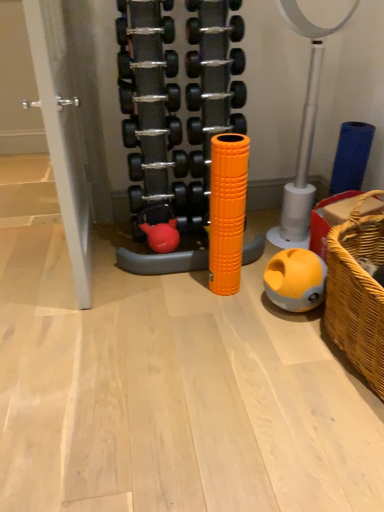
This screenshot has height=512, width=384. In order to click on yellow matte ball at lower right, positioned as the third toy in top-to-bottom order in this screenshot , I will do `click(295, 280)`.

Where is `orange rubber foam roller at center, the third toy in the bottom-to-top sequence`? orange rubber foam roller at center, the third toy in the bottom-to-top sequence is located at coordinates (177, 103).

How different are the orientations of orange rubber foam roller at center, the third toy in the bottom-to-top sequence, and woven brown basket at lower right in degrees?

orange rubber foam roller at center, the third toy in the bottom-to-top sequence, and woven brown basket at lower right are facing 90 degrees away from each other.

Does orange rubber foam roller at center, which is the 1th toy in top-to-bottom order, have a lesser height compared to woven brown basket at lower right?

Incorrect, the height of orange rubber foam roller at center, which is the 1th toy in top-to-bottom order, does not fall short of that of woven brown basket at lower right.

Is orange rubber foam roller at center, the third toy in the bottom-to-top sequence, spatially inside woven brown basket at lower right, or outside of it?

orange rubber foam roller at center, the third toy in the bottom-to-top sequence, is located beyond the bounds of woven brown basket at lower right.

Between orange rubber foam roller at center, the third toy in the bottom-to-top sequence, and woven brown basket at lower right, which one has smaller width?

woven brown basket at lower right.

From a real-world perspective, which is physically below, woven brown basket at lower right or orange rubber foam roller at center, which is the 1th toy in top-to-bottom order?

woven brown basket at lower right, from a real-world perspective.

Consider the image. From the image's perspective, which one is positioned higher, woven brown basket at lower right or orange rubber foam roller at center, the third toy in the bottom-to-top sequence?

From the image's view, orange rubber foam roller at center, the third toy in the bottom-to-top sequence, is above.

What's the angular difference between woven brown basket at lower right and orange rubber foam roller at center, which is the 1th toy in top-to-bottom order,'s facing directions?

90 degrees.

From the picture: In the image, is woven brown basket at lower right positioned in front of or behind orange rubber foam roller at center, the third toy in the bottom-to-top sequence?

Clearly, woven brown basket at lower right is in front of orange rubber foam roller at center, the third toy in the bottom-to-top sequence.

Find the location of `the 1st toy above the woven brown basket at lower right (from the image's perspective)`. the 1st toy above the woven brown basket at lower right (from the image's perspective) is located at coordinates (295, 280).

From a real-world perspective, who is located higher, yellow matte ball at lower right, the 1th toy ordered from the bottom, or woven brown basket at lower right?

From a 3D spatial view, woven brown basket at lower right is above.

From the image's perspective, which one is positioned lower, yellow matte ball at lower right, positioned as the third toy in top-to-bottom order, or woven brown basket at lower right?

woven brown basket at lower right appears lower in the image.

Is point (293, 263) farther from camera compared to point (372, 286)?

Yes, point (293, 263) is behind point (372, 286).

Based on the photo, is yellow matte ball at lower right, the 1th toy ordered from the bottom, to the left of rubberized red dumbbell at center, which ranks as the 2th toy in bottom-to-top order, from the viewer's perspective?

In fact, yellow matte ball at lower right, the 1th toy ordered from the bottom, is to the right of rubberized red dumbbell at center, which ranks as the 2th toy in bottom-to-top order.

Could you tell me if yellow matte ball at lower right, positioned as the third toy in top-to-bottom order, is facing rubberized red dumbbell at center, which ranks as the 2th toy in bottom-to-top order?

No.

Between yellow matte ball at lower right, the 1th toy ordered from the bottom, and rubberized red dumbbell at center, which ranks as the 2th toy in bottom-to-top order, which one has smaller width?

rubberized red dumbbell at center, which ranks as the 2th toy in bottom-to-top order, is thinner.

From the picture: Can you confirm if woven brown basket at lower right is positioned to the left of yellow matte ball at lower right, positioned as the third toy in top-to-bottom order?

In fact, woven brown basket at lower right is to the right of yellow matte ball at lower right, positioned as the third toy in top-to-bottom order.

Find the location of a particular element. toy that is the 1st object to the left of the woven brown basket at lower right, starting at the anchor is located at coordinates (295, 280).

From a real-world perspective, which is physically above, woven brown basket at lower right or yellow matte ball at lower right, positioned as the third toy in top-to-bottom order?

woven brown basket at lower right is physically above.

Is yellow matte ball at lower right, the 1th toy ordered from the bottom, surrounded by woven brown basket at lower right?

No.

Does yellow matte ball at lower right, positioned as the third toy in top-to-bottom order, touch orange rubber foam roller at center, the third toy in the bottom-to-top sequence?

yellow matte ball at lower right, positioned as the third toy in top-to-bottom order, and orange rubber foam roller at center, the third toy in the bottom-to-top sequence, are clearly separated.

Is yellow matte ball at lower right, positioned as the third toy in top-to-bottom order, looking in the opposite direction of orange rubber foam roller at center, the third toy in the bottom-to-top sequence?

yellow matte ball at lower right, positioned as the third toy in top-to-bottom order, is not turned away from orange rubber foam roller at center, the third toy in the bottom-to-top sequence.

Considering the relative sizes of yellow matte ball at lower right, positioned as the third toy in top-to-bottom order, and orange rubber foam roller at center, the third toy in the bottom-to-top sequence, in the image provided, is yellow matte ball at lower right, positioned as the third toy in top-to-bottom order, thinner than orange rubber foam roller at center, the third toy in the bottom-to-top sequence,?

Correct, the width of yellow matte ball at lower right, positioned as the third toy in top-to-bottom order, is less than that of orange rubber foam roller at center, the third toy in the bottom-to-top sequence.

Which is correct: orange rubber foam roller at center, the third toy in the bottom-to-top sequence, is inside yellow matte ball at lower right, the 1th toy ordered from the bottom, or outside of it?

orange rubber foam roller at center, the third toy in the bottom-to-top sequence, lies outside yellow matte ball at lower right, the 1th toy ordered from the bottom.

Locate an element on the screen. This screenshot has width=384, height=512. the 1st toy behind the orange rubber foam roller at center, the third toy in the bottom-to-top sequence, starting your count from the anchor is located at coordinates (295, 280).

Is orange rubber foam roller at center, which is the 1th toy in top-to-bottom order, thinner than yellow matte ball at lower right, positioned as the third toy in top-to-bottom order?

→ In fact, orange rubber foam roller at center, which is the 1th toy in top-to-bottom order, might be wider than yellow matte ball at lower right, positioned as the third toy in top-to-bottom order.

Based on the photo, does orange rubber foam roller at center, the third toy in the bottom-to-top sequence, appear on the left side of yellow matte ball at lower right, the 1th toy ordered from the bottom?

Yes.

The image size is (384, 512). There is a woven brown basket at lower right. What are the coordinates of `the 3rd toy above it (from the image's perspective)` in the screenshot? It's located at (177, 103).

Find the location of `basket that is below the orange rubber foam roller at center, which is the 1th toy in top-to-bottom order (from the image's perspective)`. basket that is below the orange rubber foam roller at center, which is the 1th toy in top-to-bottom order (from the image's perspective) is located at coordinates pyautogui.click(x=357, y=292).

From the image, which object appears to be farther from yellow matte ball at lower right, positioned as the third toy in top-to-bottom order, orange rubber foam roller at center, which is the 1th toy in top-to-bottom order, or woven brown basket at lower right?

orange rubber foam roller at center, which is the 1th toy in top-to-bottom order, is further to yellow matte ball at lower right, positioned as the third toy in top-to-bottom order.

In the scene shown: Which object lies further to the anchor point yellow matte ball at lower right, positioned as the third toy in top-to-bottom order, woven brown basket at lower right or rubberized red dumbbell at center, which ranks as the 2th toy in bottom-to-top order?

Among the two, rubberized red dumbbell at center, which ranks as the 2th toy in bottom-to-top order, is located further to yellow matte ball at lower right, positioned as the third toy in top-to-bottom order.

Which object lies further to the anchor point rubberized red dumbbell at center, placed as the 2th toy when sorted from top to bottom, yellow matte ball at lower right, positioned as the third toy in top-to-bottom order, or orange rubber foam roller at center, the third toy in the bottom-to-top sequence?

yellow matte ball at lower right, positioned as the third toy in top-to-bottom order.

Considering their positions, is orange rubber foam roller at center, which is the 1th toy in top-to-bottom order, positioned closer to rubberized red dumbbell at center, placed as the 2th toy when sorted from top to bottom, than woven brown basket at lower right?

orange rubber foam roller at center, which is the 1th toy in top-to-bottom order, lies closer to rubberized red dumbbell at center, placed as the 2th toy when sorted from top to bottom, than the other object.

Estimate the real-world distances between objects in this image. Which object is closer to woven brown basket at lower right, orange rubber foam roller at center, the third toy in the bottom-to-top sequence, or rubberized red dumbbell at center, which ranks as the 2th toy in bottom-to-top order?

Based on the image, orange rubber foam roller at center, the third toy in the bottom-to-top sequence, appears to be nearer to woven brown basket at lower right.

Considering their positions, is rubberized red dumbbell at center, placed as the 2th toy when sorted from top to bottom, positioned further to yellow matte ball at lower right, positioned as the third toy in top-to-bottom order, than woven brown basket at lower right?

rubberized red dumbbell at center, placed as the 2th toy when sorted from top to bottom, is further to yellow matte ball at lower right, positioned as the third toy in top-to-bottom order.

Which object lies further to the anchor point woven brown basket at lower right, rubberized red dumbbell at center, which ranks as the 2th toy in bottom-to-top order, or orange rubber foam roller at center, the third toy in the bottom-to-top sequence?

Among the two, rubberized red dumbbell at center, which ranks as the 2th toy in bottom-to-top order, is located further to woven brown basket at lower right.

Looking at this image, based on their spatial positions, is yellow matte ball at lower right, the 1th toy ordered from the bottom, or woven brown basket at lower right closer to orange rubber foam roller at center, which is the 1th toy in top-to-bottom order?

Among the two, yellow matte ball at lower right, the 1th toy ordered from the bottom, is located nearer to orange rubber foam roller at center, which is the 1th toy in top-to-bottom order.

Image resolution: width=384 pixels, height=512 pixels. I want to click on toy between orange rubber foam roller at center, which is the 1th toy in top-to-bottom order, and yellow matte ball at lower right, the 1th toy ordered from the bottom, vertically, so click(x=159, y=228).